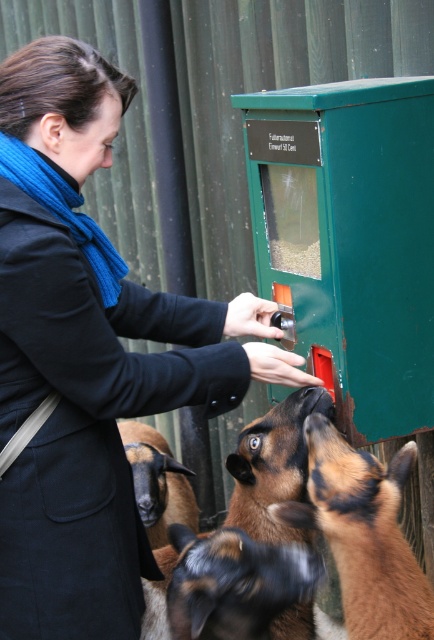
What is the exact 2D coordinate of the brown fuzzy sheep at lower center in the image?

The brown fuzzy sheep at lower center is located at the 2D coordinate point of (224, 586).

You are a delivery robot trying to reach the brown fuzzy sheep at lower center. The coordinates of the sheep are given as point (224,586). If your current position is at point 0.5, 0.5, can you safely navigate to the sheep without crossing any obstacles?

Result: The brown fuzzy sheep at lower center is located at point (224,586). Since there are no obstacles mentioned in the scene description, the delivery robot can safely navigate from point 0.5, 0.5 to the sheep at (224,586).

You are a farmer who needs to feed your animals. You see a brown fuzzy goat at center and a brown fuzzy sheep at lower center. Which animal is taller?

The brown fuzzy goat at center is much taller than the brown fuzzy sheep at lower center.